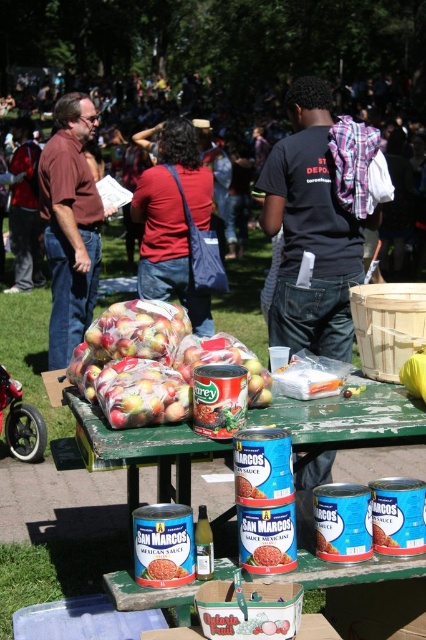
Is matte brown shirt at left to the right of smooth red sauce can at center from the viewer's perspective?

In fact, matte brown shirt at left is to the left of smooth red sauce can at center.

Is point (28, 275) in front of point (288, 556)?

No, it is behind (288, 556).

At what (x,y) coordinates should I click in order to perform the action: click on matte brown shirt at left. Please return your answer as a coordinate pair (x, y). This screenshot has height=640, width=426. Looking at the image, I should click on (25, 211).

You are a GUI agent. You are given a task and a screenshot of the screen. Output one action in this format:
    pyautogui.click(x=<x>, y=<y>)
    Task: Click on the matte brown shirt at left
    This screenshot has height=640, width=426.
    Given the screenshot: What is the action you would take?
    pyautogui.click(x=25, y=211)

Looking at this image, does matte black shirt at upper center have a larger size compared to tomato paste can at center?

Yes, matte black shirt at upper center is bigger than tomato paste can at center.

Locate an element on the screen. This screenshot has height=640, width=426. matte black shirt at upper center is located at coordinates (196, 118).

Who is higher up, matte black shirt at upper center or matte red shirt at center?

matte black shirt at upper center is above.

Which of these two, matte black shirt at upper center or matte red shirt at center, stands shorter?

Standing shorter between the two is matte red shirt at center.

Image resolution: width=426 pixels, height=640 pixels. In order to click on matte black shirt at upper center in this screenshot , I will do `click(196, 118)`.